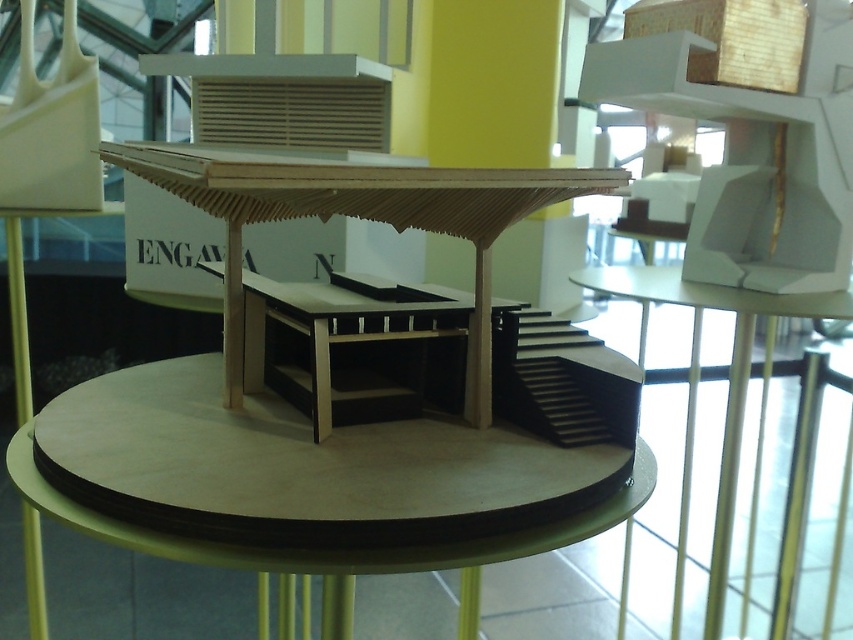
You are a curator arranging an exhibition. You have a wooden at center and a matte wood table at center. Which object has a larger width?

The wooden at center is wider than the matte wood table at center according to the description.

In the scene shown: You are a curator planning to move the wooden at center and the matte wood table at center to a new exhibition space. The new space has a 1.2 meter wide doorway. Can both objects fit through the doorway side by side?

The wooden at center is smaller than the matte wood table at center. However, the exact dimensions of both objects are not provided, so it is uncertain if their combined width would exceed the 1.2 meter doorway. Further measurements are needed to determine feasibility.